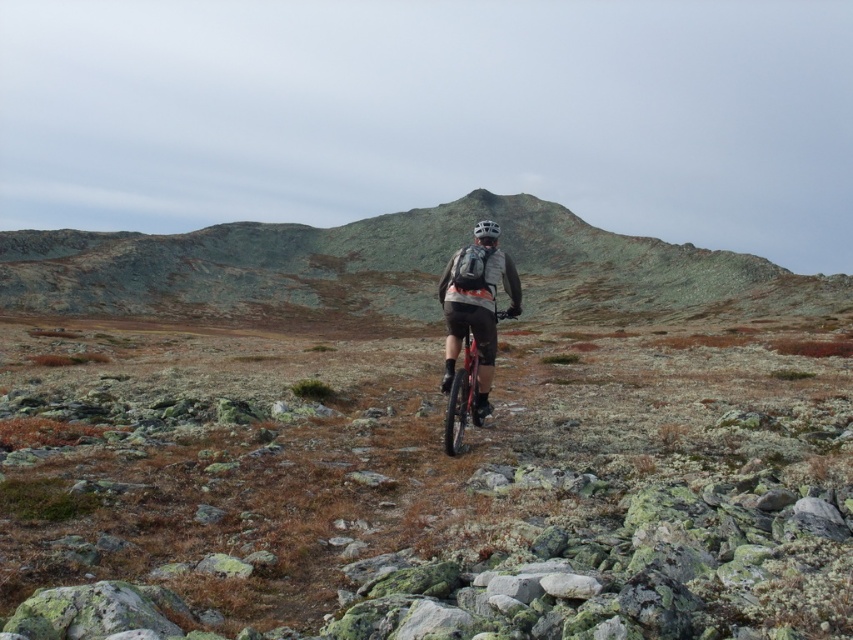
Who is more distant from viewer, (456, 301) or (490, 236)?

The point (490, 236) is more distant.

At what (x,y) coordinates should I click in order to perform the action: click on matte gray jacket at center. Please return your answer as a coordinate pair (x, y). This screenshot has height=640, width=853. Looking at the image, I should click on (476, 308).

Is rough textured rocks at center to the right of green mossy rock at center from the viewer's perspective?

Indeed, rough textured rocks at center is positioned on the right side of green mossy rock at center.

Is rough textured rocks at center wider than green mossy rock at center?

No.

This screenshot has height=640, width=853. What do you see at coordinates (426, 484) in the screenshot? I see `rough textured rocks at center` at bounding box center [426, 484].

You are a GUI agent. You are given a task and a screenshot of the screen. Output one action in this format:
    pyautogui.click(x=<x>, y=<y>)
    Task: Click on the rough textured rocks at center
    This screenshot has height=640, width=853.
    Given the screenshot: What is the action you would take?
    pyautogui.click(x=426, y=484)

Does green mossy rock at center have a larger size compared to silver metallic helmet at center?

Yes, green mossy rock at center is bigger than silver metallic helmet at center.

At what (x,y) coordinates should I click in order to perform the action: click on green mossy rock at center. Please return your answer as a coordinate pair (x, y). Looking at the image, I should click on coord(393,268).

Who is more forward, (258, 236) or (486, 237)?

Point (486, 237)

Locate an element on the screen. green mossy rock at center is located at coordinates (393, 268).